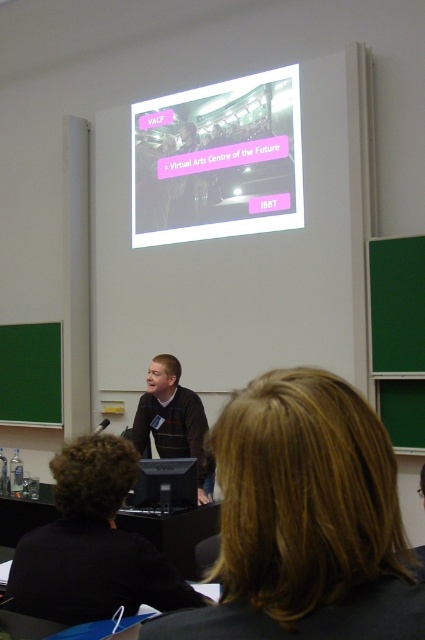
Question: Which of the following is the closest to the observer?

Choices:
 (A) (413, 586)
 (B) (192, 404)

Answer: (A)

Question: Estimate the real-world distances between objects in this image. Which object is closer to the dark brown sweater at center?

Choices:
 (A) striped sweater at center
 (B) matte plastic projector screen at upper center

Answer: (A)

Question: Is dark brown sweater at center above striped sweater at center?

Choices:
 (A) yes
 (B) no

Answer: (A)

Question: Does matte plastic projector screen at upper center have a smaller size compared to striped sweater at center?

Choices:
 (A) no
 (B) yes

Answer: (A)

Question: Based on their relative distances, which object is farther from the matte plastic projector screen at upper center?

Choices:
 (A) dark brown sweater at center
 (B) striped sweater at center

Answer: (A)

Question: Considering the relative positions of dark brown sweater at center and striped sweater at center in the image provided, where is dark brown sweater at center located with respect to striped sweater at center?

Choices:
 (A) above
 (B) below

Answer: (A)